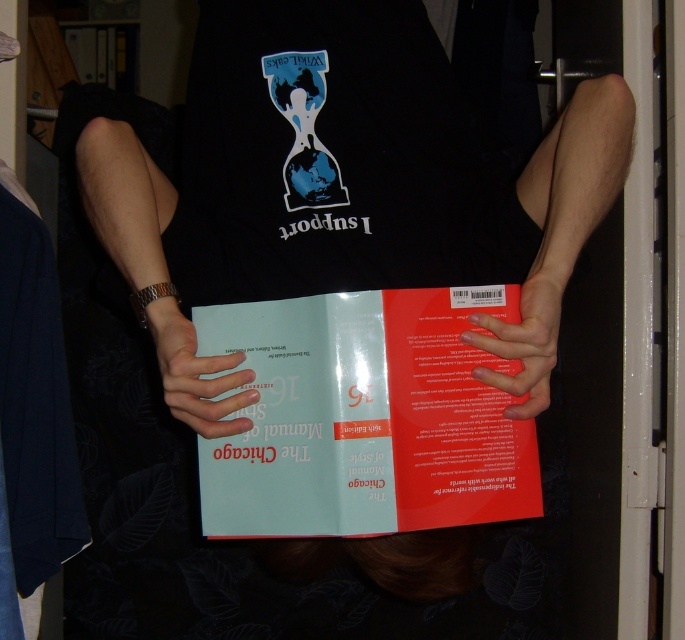
Can you confirm if matte paper book at center is positioned below smooth matte skin at center?

Indeed, matte paper book at center is positioned under smooth matte skin at center.

Is point (519, 317) positioned in front of point (493, 369)?

No, it is behind (493, 369).

This screenshot has width=685, height=640. I want to click on matte paper book at center, so click(x=364, y=417).

This screenshot has height=640, width=685. Find the location of `matte paper book at center`. matte paper book at center is located at coordinates (364, 417).

At what (x,y) coordinates should I click in order to perform the action: click on white matte paper at center. Please return your answer as a coordinate pair (x, y). The image size is (685, 640). Looking at the image, I should click on (197, 374).

Which is behind, point (184, 417) or point (495, 381)?

The point (184, 417) is behind.

Is point (245, 374) farther from camera compared to point (495, 330)?

Yes.

Locate an element on the screen. The width and height of the screenshot is (685, 640). white matte paper at center is located at coordinates (197, 374).

Can you confirm if matte paper book at center is wider than white matte paper at center?

Indeed, matte paper book at center has a greater width compared to white matte paper at center.

Can you confirm if matte paper book at center is thinner than white matte paper at center?

No, matte paper book at center is not thinner than white matte paper at center.

At what (x,y) coordinates should I click in order to perform the action: click on matte paper book at center. Please return your answer as a coordinate pair (x, y). This screenshot has width=685, height=640. Looking at the image, I should click on (364, 417).